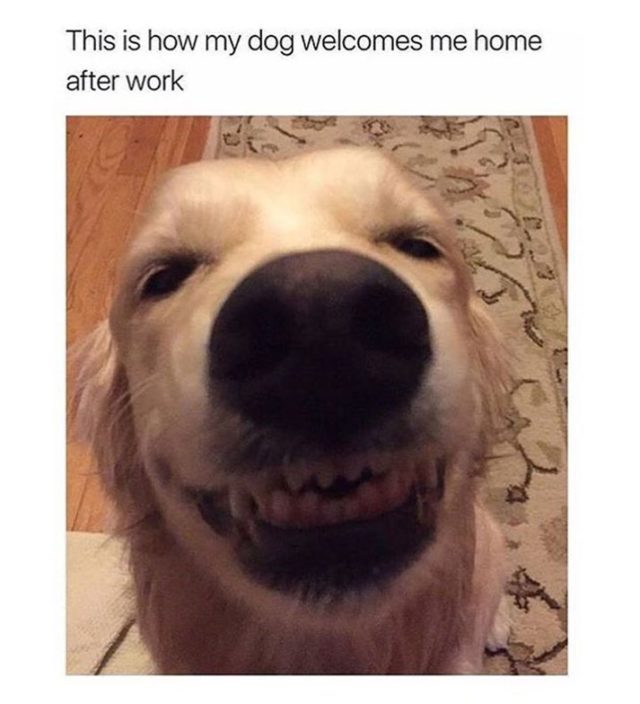
The height and width of the screenshot is (704, 640). Find the location of `hardwood floor in the backround`. hardwood floor in the backround is located at coordinates (86, 163), (100, 269), (543, 139).